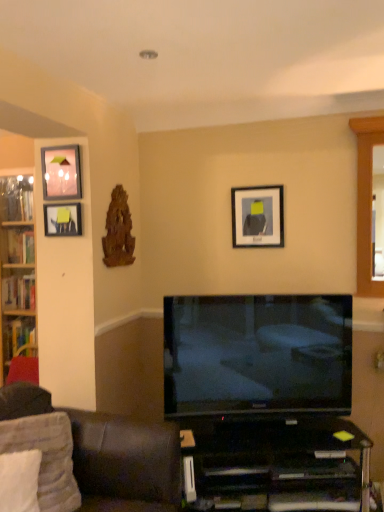
Question: Considering the positions of matte black picture frame at upper center, arranged as the 1th picture frame when viewed from the right, and dark brown leather couch at lower left in the image, is matte black picture frame at upper center, arranged as the 1th picture frame when viewed from the right, bigger or smaller than dark brown leather couch at lower left?

Choices:
 (A) small
 (B) big

Answer: (A)

Question: Considering the positions of matte black picture frame at upper center, the 3th picture frame in the left-to-right sequence, and dark brown leather couch at lower left in the image, is matte black picture frame at upper center, the 3th picture frame in the left-to-right sequence, wider or thinner than dark brown leather couch at lower left?

Choices:
 (A) thin
 (B) wide

Answer: (A)

Question: Estimate the real-world distances between objects in this image. Which object is farther from the black glossy desk at lower center?

Choices:
 (A) matte glass picture frame at upper left, which is the second picture frame in right-to-left order
 (B) white soft pillow at lower left, placed as the 1th pillow when sorted from front to back
 (C) matte black picture frame at upper center, which is the first picture frame from back to front
 (D) wooden bookshelf at left
 (E) dark brown leather couch at lower left

Answer: (A)

Question: Which of these objects is positioned farthest from the white fabric pillow at lower left, placed as the 1th pillow when sorted from back to front?

Choices:
 (A) wooden bookshelf at left
 (B) black glossy desk at lower center
 (C) matte black picture frame at upper center, arranged as the 1th picture frame when viewed from the right
 (D) matte glass picture frame at upper left, which is the second picture frame in right-to-left order
 (E) matte black picture frame at left, positioned as the second picture frame in back-to-front order

Answer: (C)